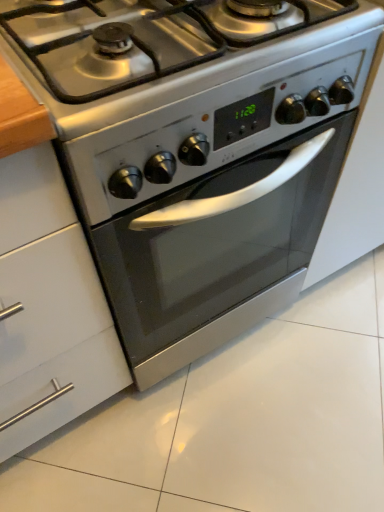
Question: From the image's perspective, is satin silver gas stove at center above or below white glossy cabinet at left?

Choices:
 (A) above
 (B) below

Answer: (A)

Question: In terms of height, does satin silver gas stove at center look taller or shorter compared to white glossy cabinet at left?

Choices:
 (A) short
 (B) tall

Answer: (A)

Question: Considering their positions, is satin silver gas stove at center located in front of or behind white glossy cabinet at left?

Choices:
 (A) behind
 (B) front

Answer: (A)

Question: Is point (16, 327) positioned closer to the camera than point (319, 56)?

Choices:
 (A) closer
 (B) farther

Answer: (B)

Question: Do you think white glossy cabinet at left is within satin silver gas stove at center, or outside of it?

Choices:
 (A) inside
 (B) outside

Answer: (B)

Question: From the image's perspective, is white glossy cabinet at left located above or below satin silver gas stove at center?

Choices:
 (A) above
 (B) below

Answer: (B)

Question: Is white glossy cabinet at left in front of or behind satin silver gas stove at center in the image?

Choices:
 (A) behind
 (B) front

Answer: (B)